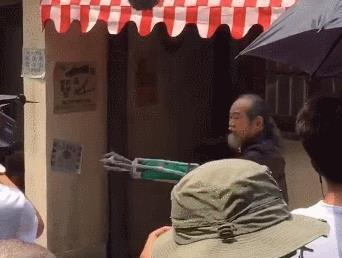
Locate an element on the screen. Image resolution: width=342 pixels, height=258 pixels. beige wall is located at coordinates click(x=36, y=171).